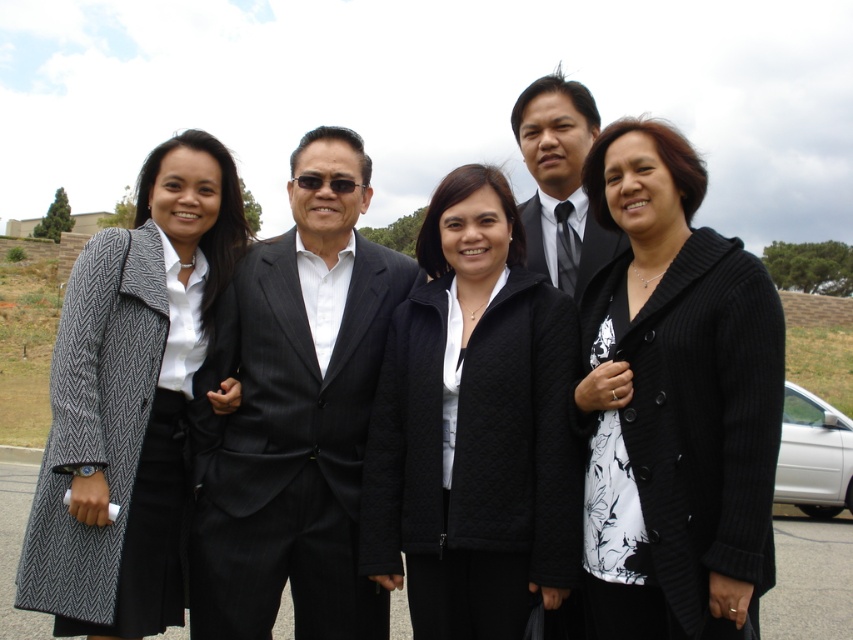
Who is lower down, black ribbed cardigan at center or gray herringbone coat at left?

Positioned lower is gray herringbone coat at left.

Between point (662, 278) and point (112, 362), which one is positioned in front?

Positioned in front is point (662, 278).

The height and width of the screenshot is (640, 853). What do you see at coordinates (679, 396) in the screenshot? I see `black ribbed cardigan at center` at bounding box center [679, 396].

I want to click on black ribbed cardigan at center, so click(x=679, y=396).

Can you confirm if black quilted jacket at center is positioned to the left of matte black suit at center?

Indeed, black quilted jacket at center is positioned on the left side of matte black suit at center.

Is point (421, 320) closer to camera compared to point (569, 136)?

Yes, point (421, 320) is closer to viewer.

You are a GUI agent. You are given a task and a screenshot of the screen. Output one action in this format:
    pyautogui.click(x=<x>, y=<y>)
    Task: Click on the black quilted jacket at center
    
    Given the screenshot: What is the action you would take?
    pyautogui.click(x=474, y=426)

Looking at this image, between black ribbed cardigan at center and dark gray pinstripe suit at center, which one has less height?

dark gray pinstripe suit at center

Does point (643, 240) lie in front of point (351, 148)?

Yes, it is in front of point (351, 148).

Identify the location of black ribbed cardigan at center. Image resolution: width=853 pixels, height=640 pixels. (679, 396).

Find the location of a particular element. black ribbed cardigan at center is located at coordinates [679, 396].